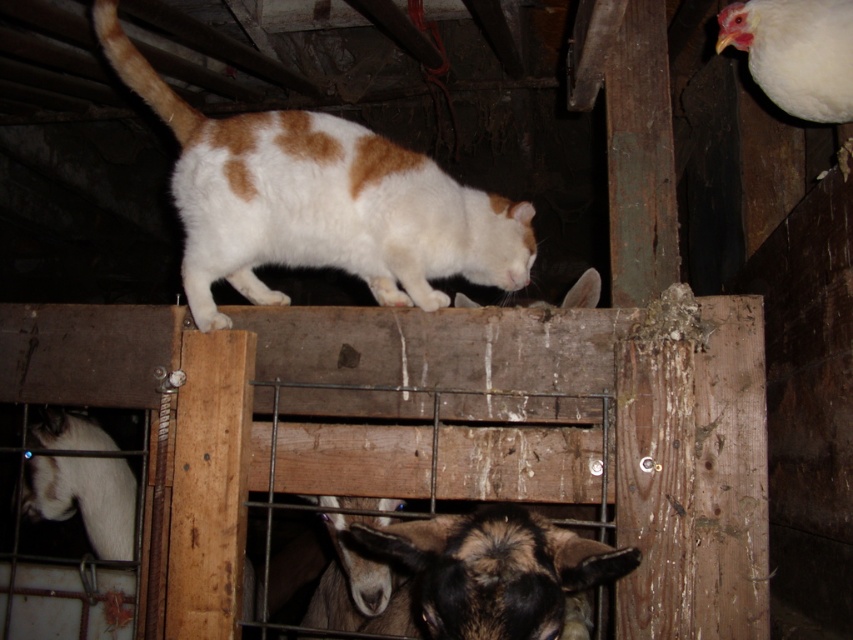
From the picture: You are standing at the entrance of the barn and see the brown fuzzy goat at lower center. If you want to approach it, which direction should you move relative to your current position?

The brown fuzzy goat at lower center is located at coordinates point (490,572). To approach it, you should move forward and to the right from your current position at the entrance.

You are a farmer checking the barn. You notice the white fur cat at upper center and the white woolen goat at lower left. Which animal is taller?

The white fur cat at upper center is much taller than the white woolen goat at lower left.

You are a farmer checking the barn. You notice the white fur cat at upper center and the white woolen goat at lower left. Which animal would cast a bigger shadow if the sun is directly overhead?

The white fur cat at upper center is larger in size than the white woolen goat at lower left, so it would cast a bigger shadow.